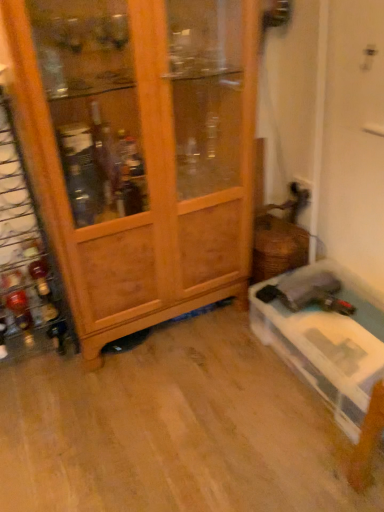
Question: Considering the relative positions of shiny amber glass bottle at left, acting as the 1th bottle starting from the top, and wooden wine rack at left in the image provided, is shiny amber glass bottle at left, acting as the 1th bottle starting from the top, in front of wooden wine rack at left?

Choices:
 (A) yes
 (B) no

Answer: (B)

Question: From a real-world perspective, is shiny amber glass bottle at left, which is the second bottle from bottom to top, located higher than wooden wine rack at left?

Choices:
 (A) no
 (B) yes

Answer: (A)

Question: Considering the relative sizes of shiny amber glass bottle at left, which is the second bottle from bottom to top, and wooden wine rack at left in the image provided, is shiny amber glass bottle at left, which is the second bottle from bottom to top, wider than wooden wine rack at left?

Choices:
 (A) yes
 (B) no

Answer: (A)

Question: Is the surface of shiny amber glass bottle at left, acting as the 1th bottle starting from the top, in direct contact with wooden wine rack at left?

Choices:
 (A) no
 (B) yes

Answer: (B)

Question: Is shiny amber glass bottle at left, which is the second bottle from bottom to top, oriented away from wooden wine rack at left?

Choices:
 (A) yes
 (B) no

Answer: (A)

Question: Could you tell me if shiny amber glass bottle at left, which is the second bottle from bottom to top, is turned towards wooden wine rack at left?

Choices:
 (A) no
 (B) yes

Answer: (B)

Question: Considering the relative sizes of wooden wine rack at left and shiny amber glass bottle at left, acting as the 1th bottle starting from the top, in the image provided, is wooden wine rack at left thinner than shiny amber glass bottle at left, acting as the 1th bottle starting from the top,?

Choices:
 (A) no
 (B) yes

Answer: (B)

Question: Is wooden wine rack at left next to shiny amber glass bottle at left, which is the second bottle from bottom to top, and touching it?

Choices:
 (A) no
 (B) yes

Answer: (B)

Question: Is wooden wine rack at left to the left of shiny amber glass bottle at left, acting as the 1th bottle starting from the top, from the viewer's perspective?

Choices:
 (A) yes
 (B) no

Answer: (A)

Question: Considering the relative positions of wooden wine rack at left and shiny amber glass bottle at left, which is the second bottle from bottom to top, in the image provided, is wooden wine rack at left to the right of shiny amber glass bottle at left, which is the second bottle from bottom to top, from the viewer's perspective?

Choices:
 (A) no
 (B) yes

Answer: (A)

Question: Is wooden wine rack at left in front of shiny amber glass bottle at left, acting as the 1th bottle starting from the top?

Choices:
 (A) no
 (B) yes

Answer: (B)

Question: Is shiny amber glass bottle at left, acting as the 1th bottle starting from the top, completely or partially inside wooden wine rack at left?

Choices:
 (A) no
 (B) yes

Answer: (B)